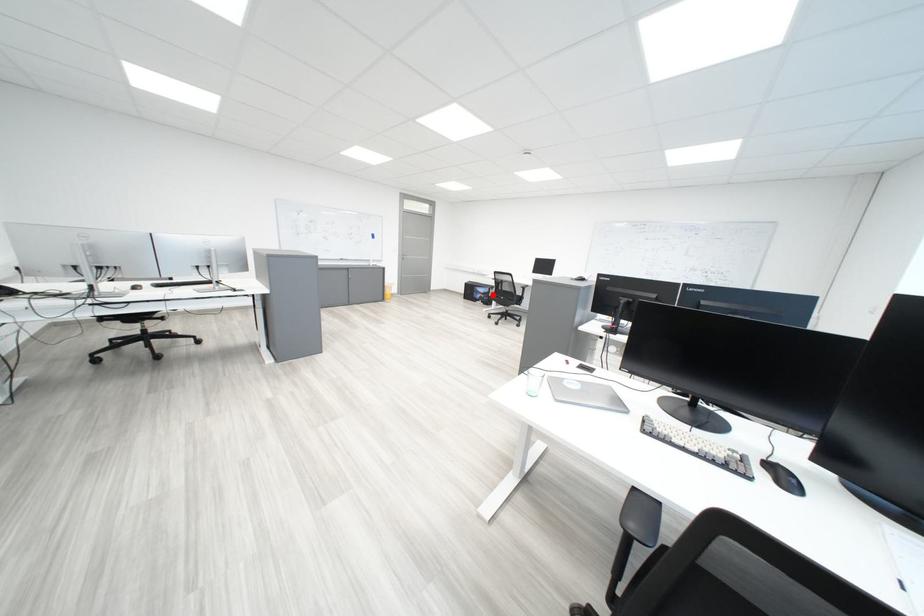
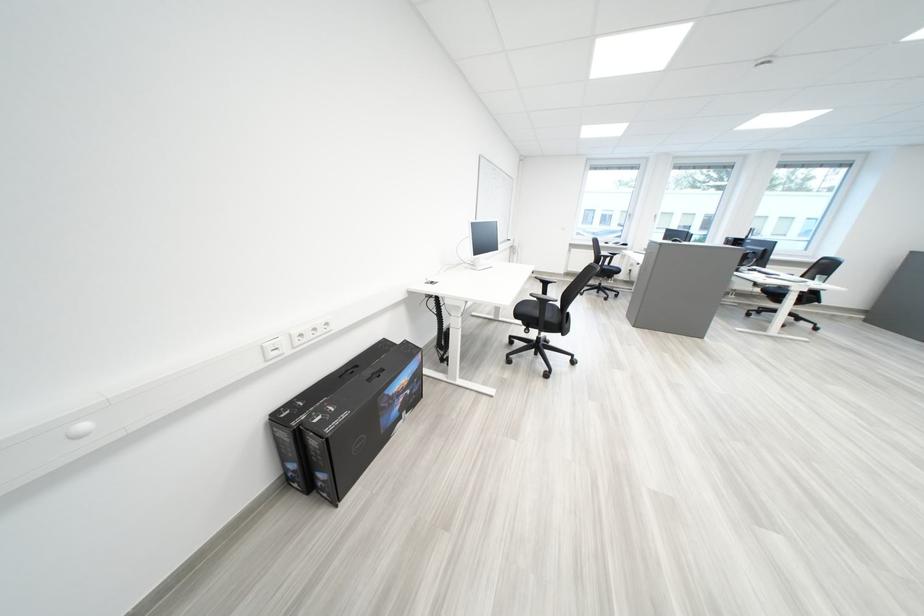
Question: I am providing you with two images of the same scene from different viewpoints. A red point is marked on the first image. At the location where the point appears in image 1, is it still visible in image 2?

Choices:
 (A) Yes
 (B) No

Answer: (A)